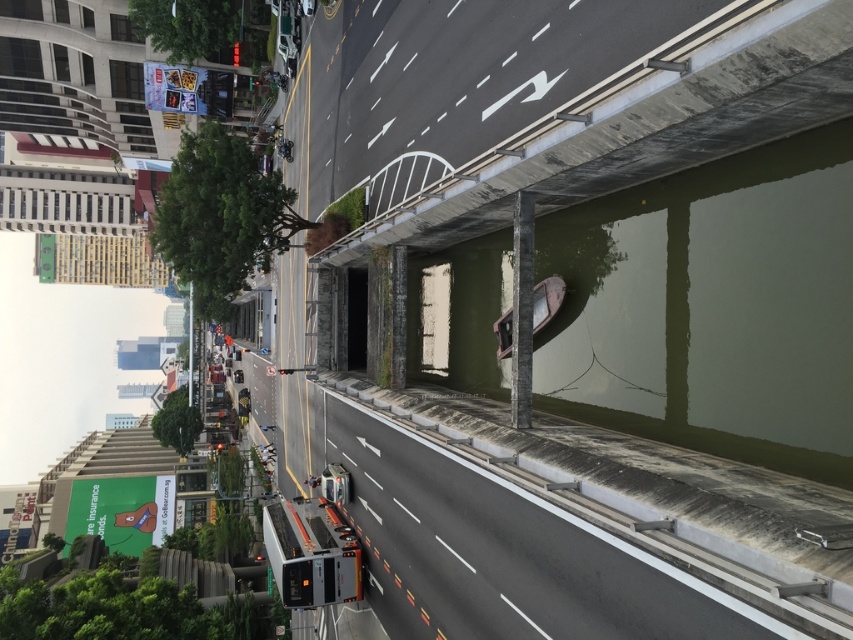
You are a pedestrian standing at point [480,624] and want to cross the road to reach the canal. There is a bus approaching from the direction of point [473,77]. Based on their positions, is the bus behind or in front of you?

The bus is approaching from point [473,77], which is behind you since point [473,77] is behind point [480,624]. Therefore, the bus is behind you.

You are a delivery drone that needs to fly from the concrete at upper center to the gray asphalt highway at center. What is the minimum vertical distance you must maintain to safely pass between them?

The concrete at upper center and gray asphalt highway at center are 32.46 feet apart, so the minimum vertical distance you must maintain is 32.46 feet to safely pass between them.

You are a drone operator trying to deliver a package. You need to fly your drone from the concrete at upper center to the gray asphalt highway at center. According to the scene description, can the drone fly directly between these two points without obstacles?

The concrete at upper center is above the gray asphalt highway at center, so the drone can fly directly between these two points without obstacles since there is no mention of any barriers between them in the scene description.